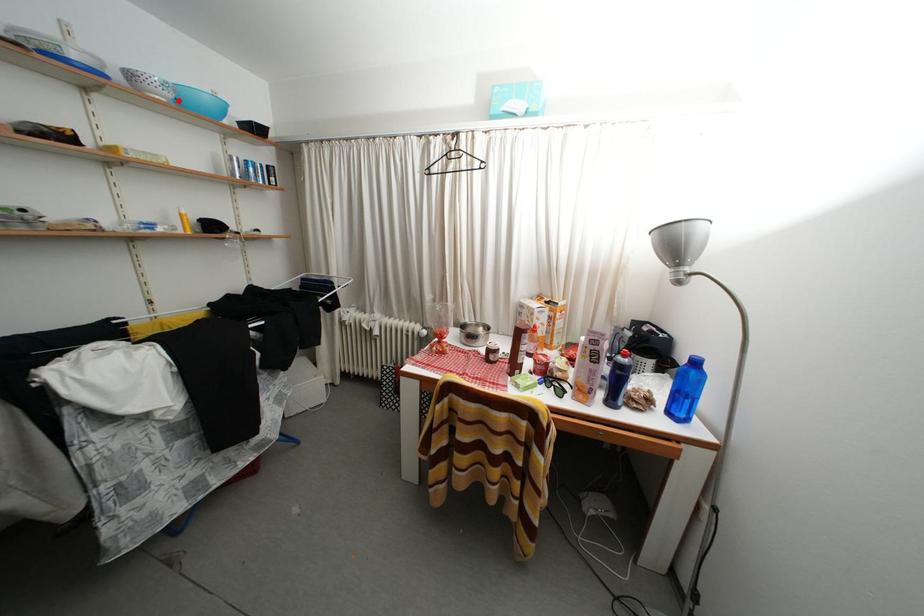
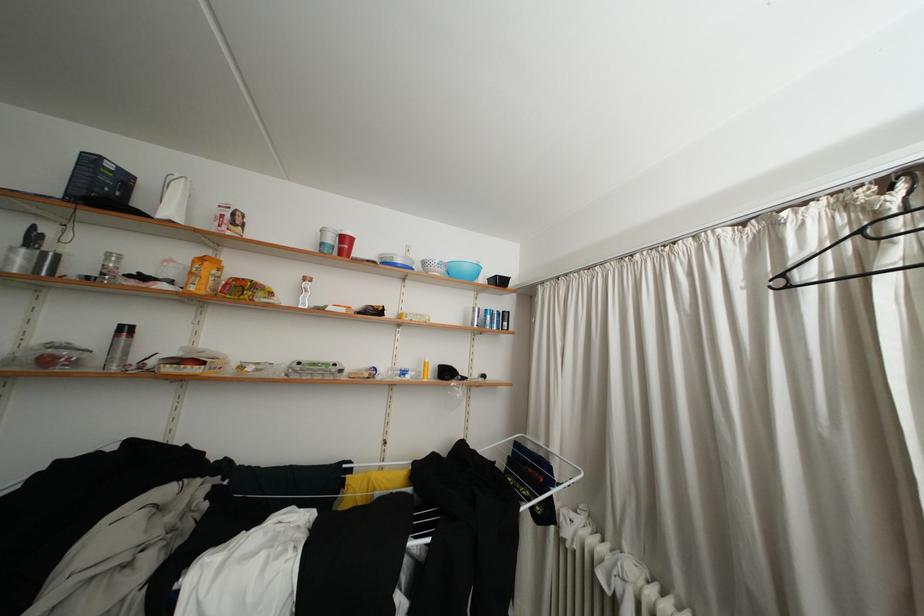
Question: I am providing you with two images of the same scene from different viewpoints. A red point is marked on the first image. Is the red point's position out of view in image 2?

Choices:
 (A) Yes
 (B) No

Answer: (B)